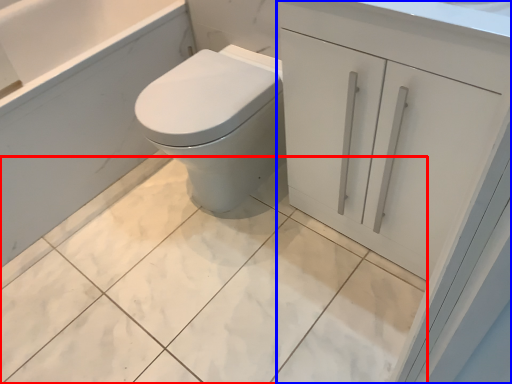
Question: Which object is further to the camera taking this photo, ceramic tile (highlighted by a red box) or bathroom cabinet (highlighted by a blue box)?

Choices:
 (A) ceramic tile
 (B) bathroom cabinet

Answer: (A)